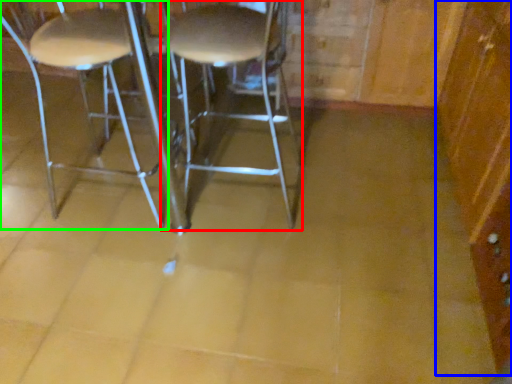
Question: Which is nearer to the stool (highlighted by a red box)? dresser (highlighted by a blue box) or chair (highlighted by a green box).

Choices:
 (A) dresser
 (B) chair

Answer: (B)